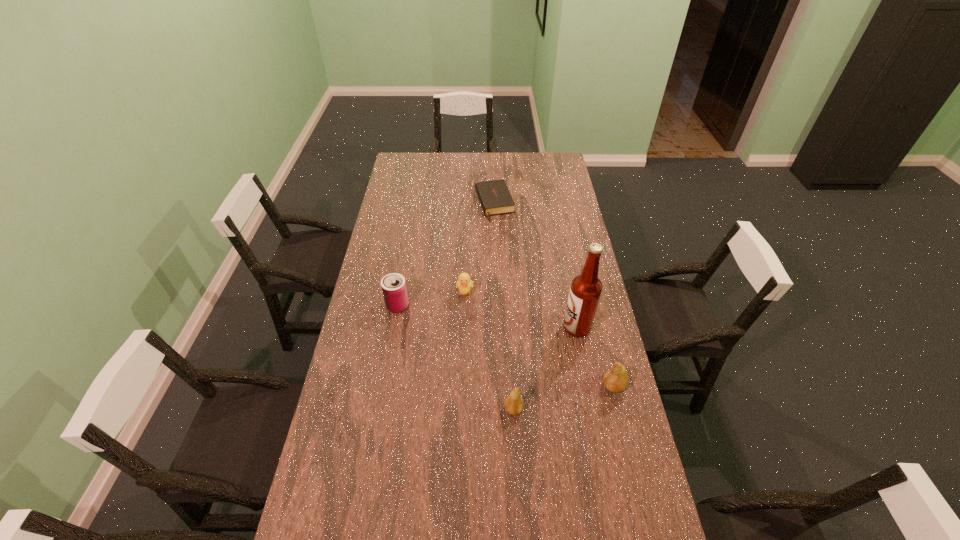
Find the location of a particular element. free space between the fourth farthest object and the can is located at coordinates (488, 316).

This screenshot has height=540, width=960. Identify the location of empty location between the leftmost object and the right pear. (505, 346).

Identify the location of free space between the left pear and the shortest object. This screenshot has width=960, height=540. (504, 307).

This screenshot has width=960, height=540. Identify the location of vacant region between the fourth farthest object and the second nearest object. (595, 356).

The height and width of the screenshot is (540, 960). I want to click on free space that is in between the farthest object and the fifth farthest object, so click(x=554, y=295).

Where is `vacant region between the duckling and the farther pear`? The image size is (960, 540). vacant region between the duckling and the farther pear is located at coordinates (540, 340).

Find the location of `object that can be found as the third closest to the fifth object from right to left`. object that can be found as the third closest to the fifth object from right to left is located at coordinates (494, 196).

This screenshot has width=960, height=540. I want to click on object identified as the closest to the shortest object, so click(x=464, y=284).

I want to click on free spot that satisfies the following two spatial constraints: 1. on the label side of the taller pear; 2. on the right side of the third nearest object, so click(x=588, y=386).

Locate an element on the screen. The height and width of the screenshot is (540, 960). free region that satisfies the following two spatial constraints: 1. on the label side of the tallest object; 2. on the left side of the farther pear is located at coordinates (588, 386).